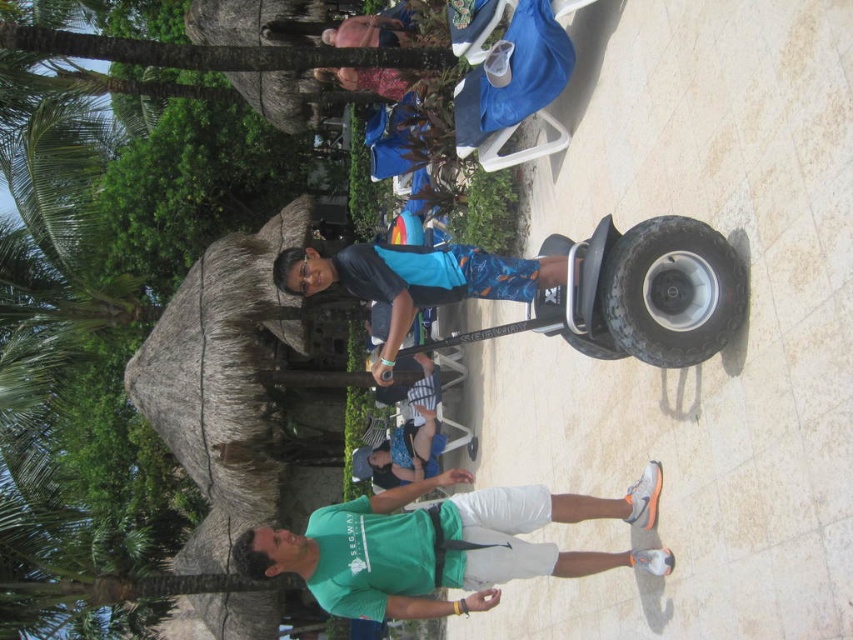
Question: Which point appears closest to the camera in this image?

Choices:
 (A) (390, 362)
 (B) (688, 269)

Answer: (B)

Question: Which of these objects is positioned farthest from the black rubber tire at center?

Choices:
 (A) denim shorts at lower center
 (B) blue fabric shorts at center

Answer: (A)

Question: Can you confirm if black rubber tire at center is positioned to the right of blue fabric shorts at center?

Choices:
 (A) no
 (B) yes

Answer: (B)

Question: Observing the image, what is the correct spatial positioning of blue fabric shorts at center in reference to denim shorts at lower center?

Choices:
 (A) right
 (B) left

Answer: (B)

Question: Where is black rubber tire at center located in relation to blue fabric shorts at center in the image?

Choices:
 (A) right
 (B) left

Answer: (A)

Question: Which point is farther to the camera?

Choices:
 (A) denim shorts at lower center
 (B) blue fabric shorts at center

Answer: (A)